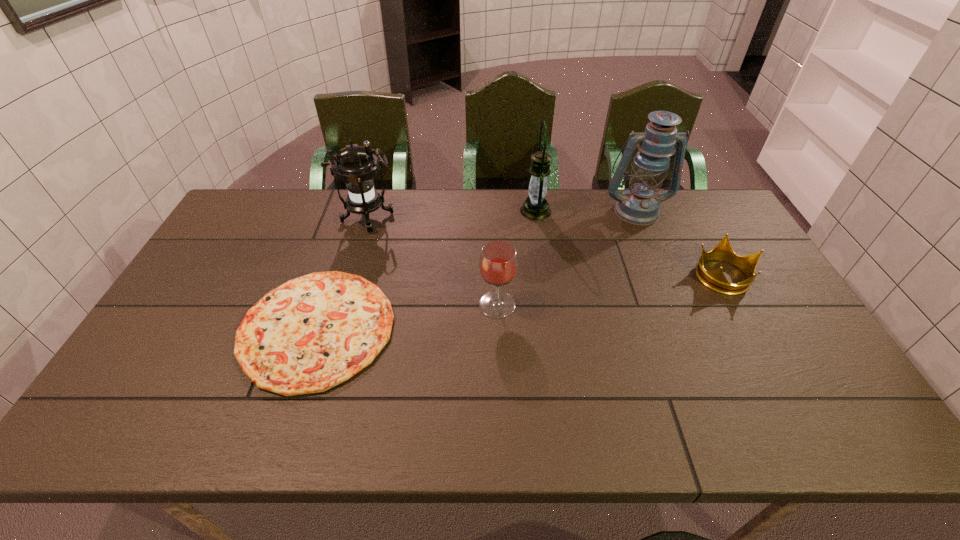
In order to click on the rightmost lantern in this screenshot , I will do 639,205.

You are a GUI agent. You are given a task and a screenshot of the screen. Output one action in this format:
    pyautogui.click(x=<x>, y=<y>)
    Task: Click on the second lantern from right to left
    The height and width of the screenshot is (540, 960).
    Given the screenshot: What is the action you would take?
    pyautogui.click(x=535, y=207)

Where is `the leftmost lantern`? This screenshot has height=540, width=960. the leftmost lantern is located at coordinates (356, 167).

Locate an element on the screen. the third object from left to right is located at coordinates (498, 264).

This screenshot has height=540, width=960. I want to click on the third shortest object, so click(498, 264).

This screenshot has width=960, height=540. I want to click on crown, so click(715, 280).

Where is `the shortest object`? the shortest object is located at coordinates (312, 333).

At what (x,y) coordinates should I click in order to perform the action: click on vacant area situated on the front-facing side of the rightmost lantern. Please return your answer as a coordinate pair (x, y). This screenshot has height=540, width=960. Looking at the image, I should click on (651, 247).

This screenshot has height=540, width=960. Find the location of `free space located on the side where the fourth object from left to right emits light`. free space located on the side where the fourth object from left to right emits light is located at coordinates [x=420, y=211].

Locate an element on the screen. The width and height of the screenshot is (960, 540). free point located on the side where the fourth object from left to right emits light is located at coordinates (483, 211).